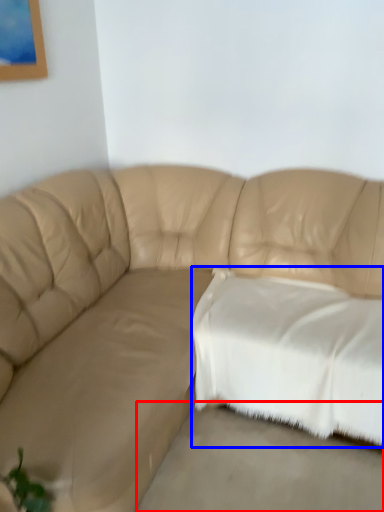
Question: Which point is further to the camera, concrete (highlighted by a red box) or pillow (highlighted by a blue box)?

Choices:
 (A) concrete
 (B) pillow

Answer: (B)